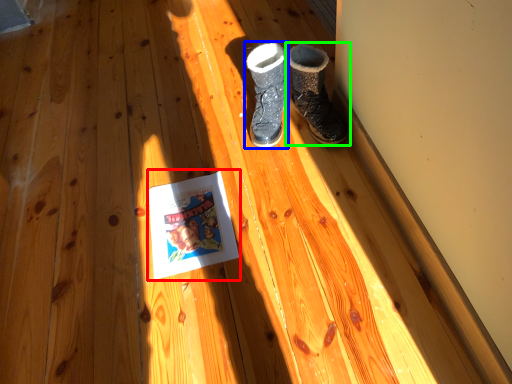
Question: Based on their relative distances, which object is nearer to paperback book (highlighted by a red box)? Choose from footwear (highlighted by a blue box) and footwear (highlighted by a green box).

Choices:
 (A) footwear
 (B) footwear

Answer: (A)